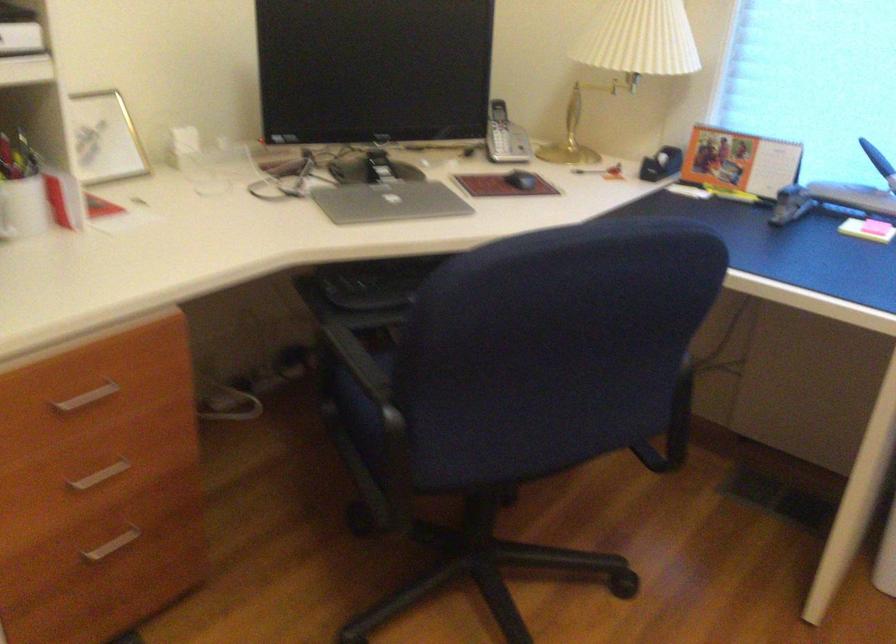
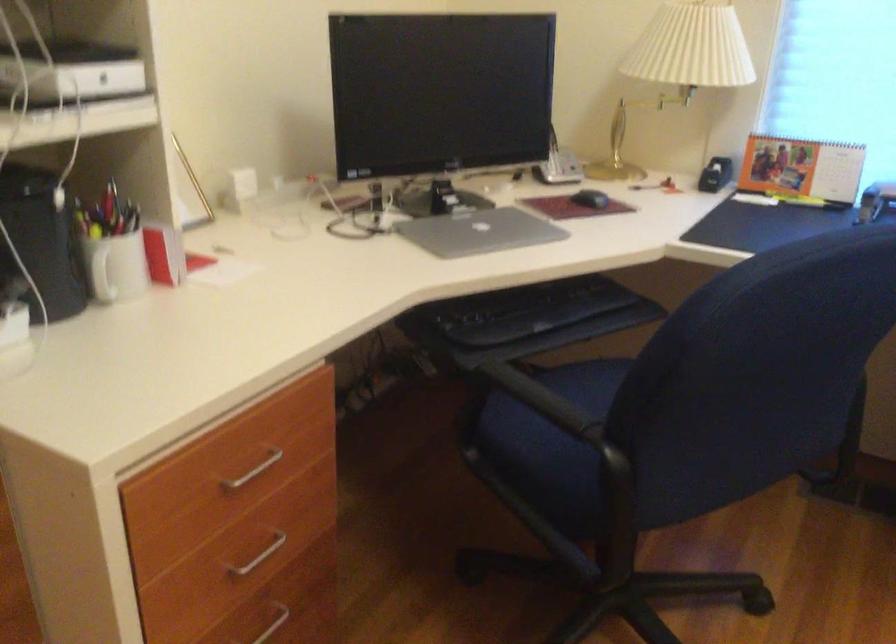
Question: The camera is either moving clockwise (left) or counter-clockwise (right) around the object. The first image is from the beginning of the video and the second image is from the end. Is the camera moving left or right when shooting the video?

Choices:
 (A) Left
 (B) Right

Answer: (A)